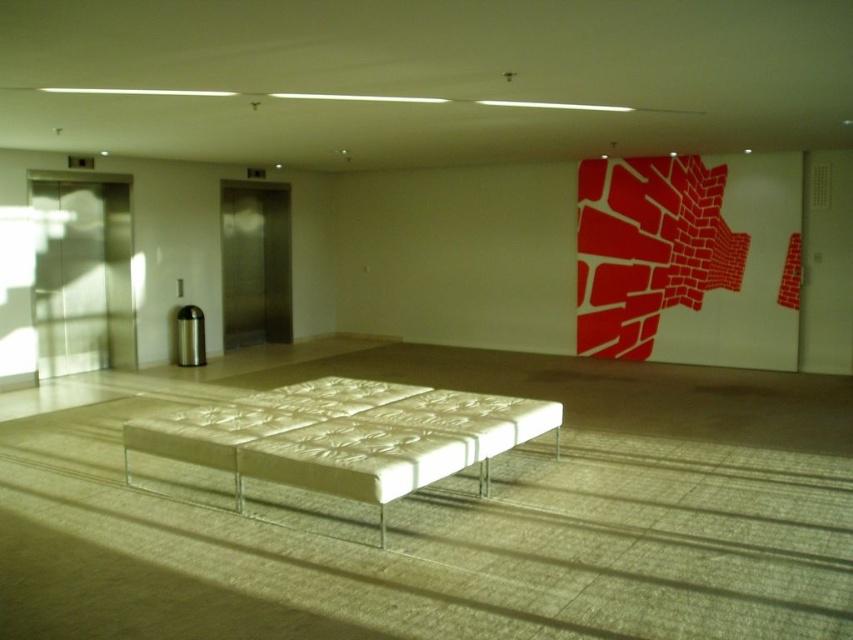
Question: Which point appears farthest from the camera in this image?

Choices:
 (A) (270, 307)
 (B) (485, 497)
 (C) (94, 352)

Answer: (A)

Question: Based on their relative distances, which object is nearer to the polished stainless steel elevator at left?

Choices:
 (A) white textured bench at center
 (B) stainless steel elevator at left

Answer: (B)

Question: Estimate the real-world distances between objects in this image. Which object is closer to the stainless steel elevator at left?

Choices:
 (A) white textured bench at center
 (B) polished stainless steel elevator at left

Answer: (B)

Question: Is white textured bench at center smaller than stainless steel elevator at left?

Choices:
 (A) no
 (B) yes

Answer: (A)

Question: In this image, where is polished stainless steel elevator at left located relative to stainless steel elevator at left?

Choices:
 (A) below
 (B) above

Answer: (A)

Question: Considering the relative positions of white textured bench at center and polished stainless steel elevator at left in the image provided, where is white textured bench at center located with respect to polished stainless steel elevator at left?

Choices:
 (A) below
 (B) above

Answer: (A)